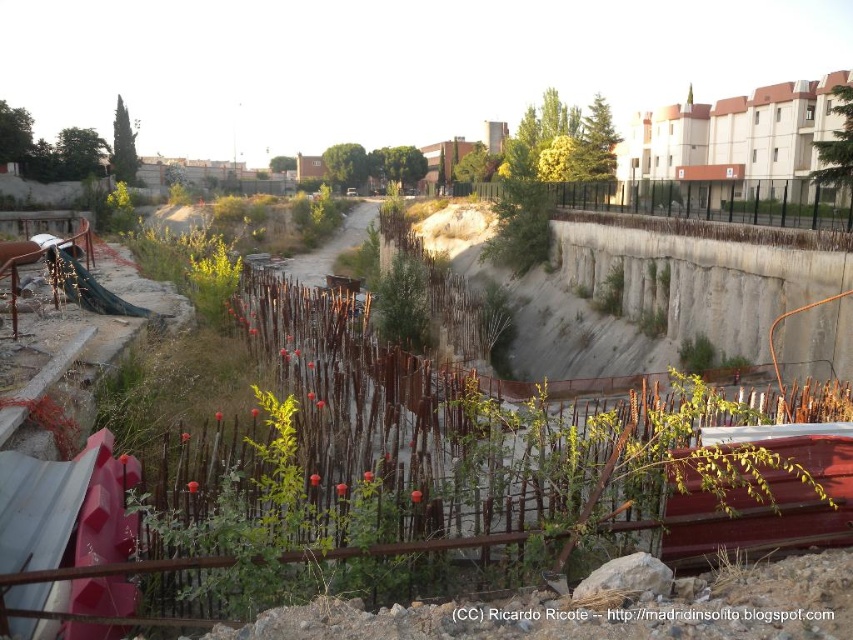
You are a construction worker who needs to move a heavy crate from the smooth concrete hillside at center to the rustic wooden boat at lower right. Considering the height difference between them, will you need a ramp or stairs to safely move the crate down?

The smooth concrete hillside at center is much taller than the rustic wooden boat at lower right. Since there is a significant height difference, you will need a ramp or stairs to safely move the crate down.

You are a construction worker standing at the point marked by the coordinates point (x=694, y=282). Looking around, you notice the smooth concrete hillside at center. What is the terrain like immediately around your current position?

The point (x=694, y=282) marks the smooth concrete hillside at center, so the terrain around your current position is smooth concrete.

You are a delivery driver who needs to park your truck, which is 3 meters wide, near the construction site. The only available space is between the smooth concrete hillside at center and the rustic wooden boat at lower right. Can your truck fit in that space?

The smooth concrete hillside at center is wider than the rustic wooden boat at lower right. However, the exact width of the space between them isn